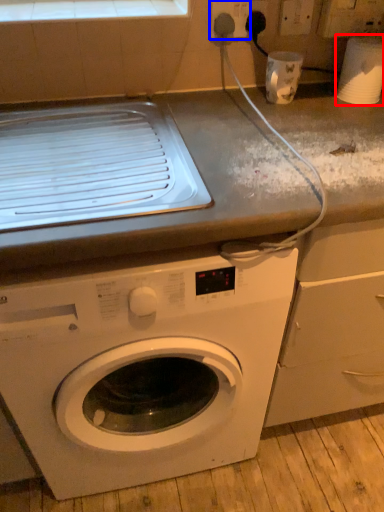
Question: Which object appears farthest to the camera in this image, appliance (highlighted by a red box) or electric outlet (highlighted by a blue box)?

Choices:
 (A) appliance
 (B) electric outlet

Answer: (B)